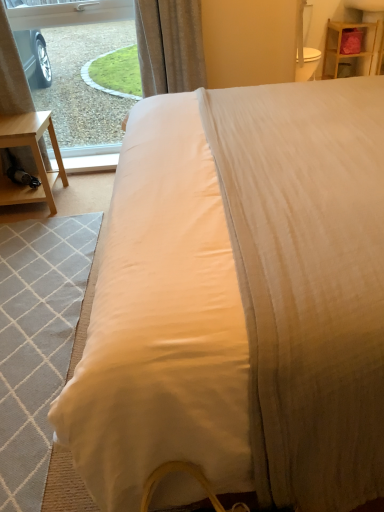
Question: Is satin curtain at upper center taller or shorter than wooden shelf at upper right?

Choices:
 (A) tall
 (B) short

Answer: (A)

Question: Based on their positions, is satin curtain at upper center located to the left or right of wooden shelf at upper right?

Choices:
 (A) left
 (B) right

Answer: (A)

Question: Which is nearer to the wooden shelf at upper right?

Choices:
 (A) light gray woven mat at lower left
 (B) transparent glass window at upper left
 (C) satin curtain at upper center

Answer: (C)

Question: Which object is the closest to the satin curtain at upper center?

Choices:
 (A) wooden shelf at upper right
 (B) transparent glass window at upper left
 (C) light gray woven mat at lower left

Answer: (B)